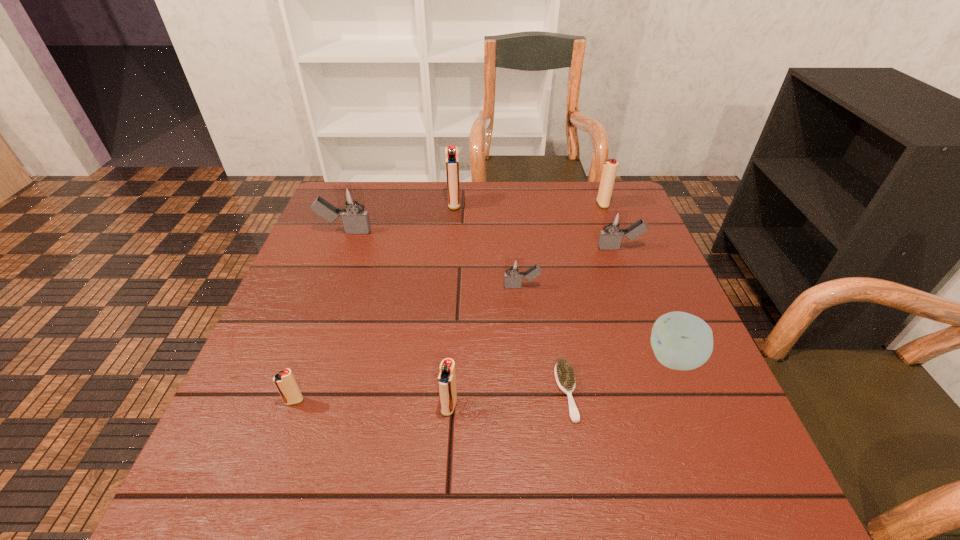
Locate an element on the screen. This screenshot has height=540, width=960. vacant space that satisfies the following two spatial constraints: 1. on the front side of the third igniter from right to left; 2. on the right side of the leftmost gray igniter is located at coordinates (324, 287).

Locate an element on the screen. free space that satisfies the following two spatial constraints: 1. on the back side of the second biggest red igniter; 2. on the left side of the third nearest igniter is located at coordinates (514, 204).

At what (x,y) coordinates should I click in order to perform the action: click on vacant region that satisfies the following two spatial constraints: 1. on the front side of the nearest gray igniter; 2. on the right side of the farthest gray igniter. Please return your answer as a coordinate pair (x, y). Looking at the image, I should click on (324, 287).